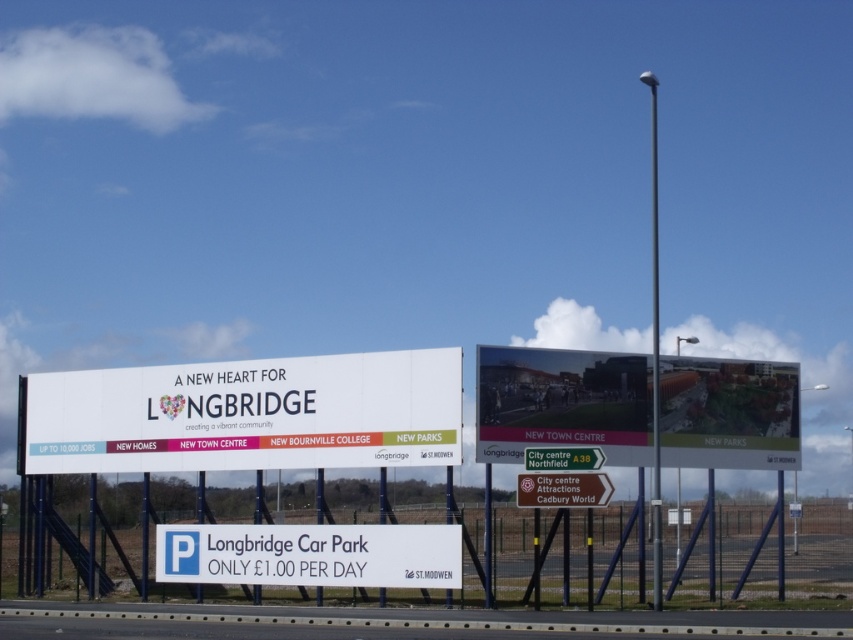
Question: Considering the real-world distances, which object is farthest from the white plastic sign at lower center?

Choices:
 (A) black metal pole at center
 (B) white matte signboard at center
 (C) matte plastic billboard at center
 (D) metallic signpost at center

Answer: (A)

Question: Based on their relative distances, which object is farther from the matte plastic billboard at center?

Choices:
 (A) white plastic sign at lower center
 (B) black metal pole at center
 (C) white matte signboard at center

Answer: (C)

Question: Estimate the real-world distances between objects in this image. Which object is closer to the matte plastic billboard at center?

Choices:
 (A) white matte signboard at center
 (B) metallic signpost at center
 (C) white plastic sign at lower center
 (D) black metal pole at center

Answer: (B)

Question: Is matte plastic billboard at center bigger than black metal pole at center?

Choices:
 (A) yes
 (B) no

Answer: (B)

Question: Is black metal pole at center to the right of metallic signpost at center from the viewer's perspective?

Choices:
 (A) yes
 (B) no

Answer: (A)

Question: Can you confirm if white matte signboard at center is bigger than metallic signpost at center?

Choices:
 (A) yes
 (B) no

Answer: (A)